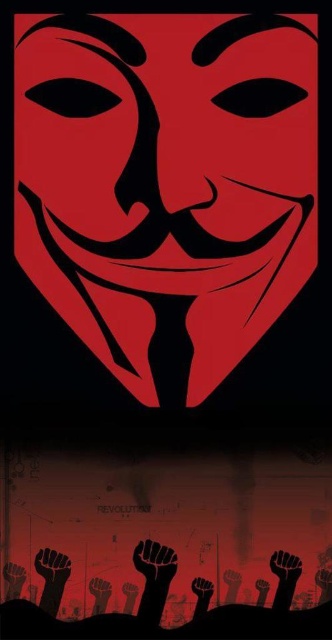
Between black matte fist at lower center and black matte hand at lower center, which one appears on the right side from the viewer's perspective?

black matte hand at lower center is more to the right.

Which is more to the left, black matte fist at lower center or black matte hand at lower center?

Positioned to the left is black matte fist at lower center.

Describe the element at coordinates (155, 561) in the screenshot. I see `black matte fist at lower center` at that location.

The width and height of the screenshot is (332, 640). In order to click on black matte fist at lower center in this screenshot , I will do `click(155, 561)`.

Is matte red mask at center positioned in front of black matte fist at lower center?

That is True.

Between point (194, 266) and point (147, 547), which one is positioned in front?

Point (194, 266)

Identify the location of matte red mask at center. Image resolution: width=332 pixels, height=640 pixels. (167, 182).

Is point (214, 186) positioned behind point (291, 580)?

No, it is in front of (291, 580).

The image size is (332, 640). Find the location of `matte red mask at center`. matte red mask at center is located at coordinates (167, 182).

Identify the location of matte red mask at center. The image size is (332, 640). [167, 182].